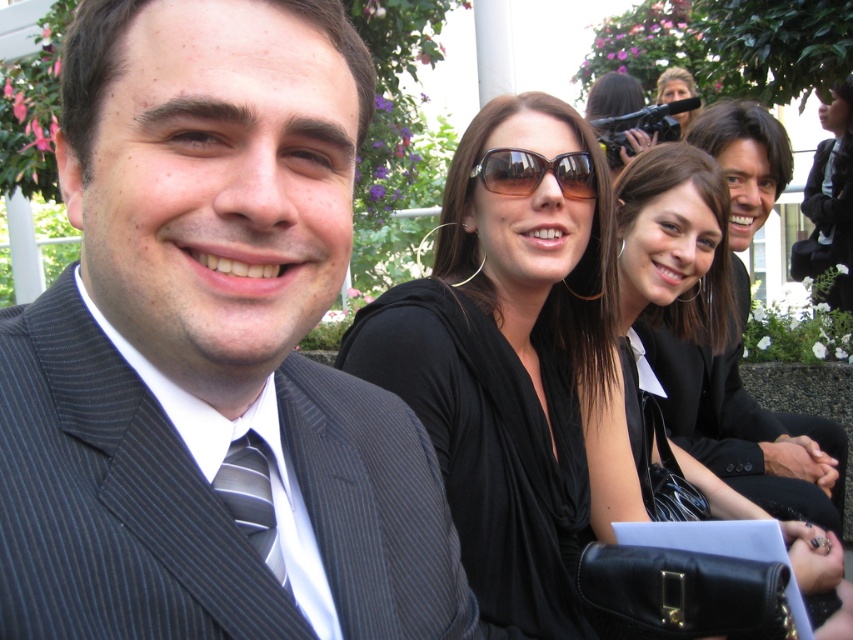
You are a photographer adjusting the camera settings to focus on both the black satin dress at center and the sunglasses at upper center. Since the camera can only focus on one object at a time, which object should you choose to ensure the larger one is in focus?

The black satin dress at center is larger than the sunglasses at upper center, so you should focus on the black satin dress at center to ensure the larger object is in focus.

Based on the scene description, where is the pinstriped suit at center in relation to the striped fabric tie at left?

The pinstriped suit at center is to the left of the striped fabric tie at left.

Based on the scene description, where is the pinstriped suit at center located in the image?

The pinstriped suit at center is located at point 0.442 on the horizontal axis and 0.307 on the vertical axis.